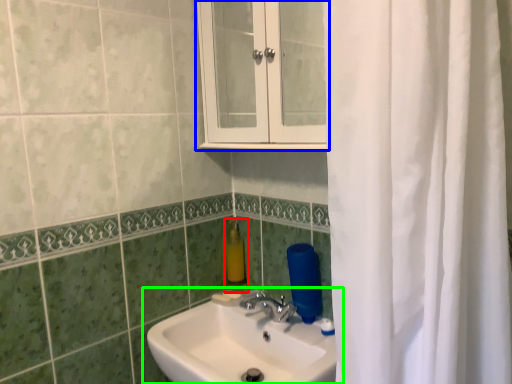
Question: Considering the real-world distances, which object is farthest from soap dispenser (highlighted by a red box)? medicine cabinet (highlighted by a blue box) or sink (highlighted by a green box)?

Choices:
 (A) medicine cabinet
 (B) sink

Answer: (A)